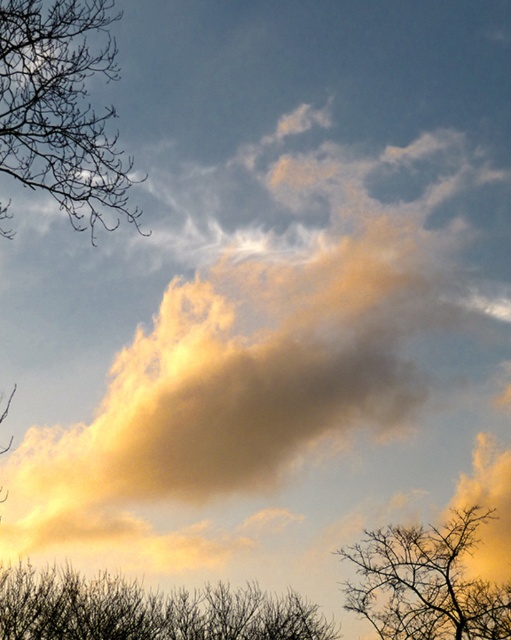
Can you confirm if silhouette bare branches at bottom is positioned to the left of brown textured tree at lower right?

Indeed, silhouette bare branches at bottom is positioned on the left side of brown textured tree at lower right.

Does silhouette bare branches at bottom have a lesser width compared to brown textured tree at lower right?

No, silhouette bare branches at bottom is not thinner than brown textured tree at lower right.

This screenshot has height=640, width=511. I want to click on silhouette bare branches at bottom, so [146, 609].

Is point (25, 44) farther from viewer compared to point (299, 609)?

No, it is in front of (299, 609).

Is bare branches at left positioned at the back of silhouette bare branches at bottom?

No, bare branches at left is closer to the viewer.

Which is behind, point (99, 141) or point (291, 598)?

Positioned behind is point (291, 598).

Image resolution: width=511 pixels, height=640 pixels. I want to click on bare branches at left, so click(61, 108).

Does bare branches at left lie in front of brown textured tree at lower right?

Yes, bare branches at left is closer to the viewer.

Which is behind, point (60, 132) or point (479, 616)?

The point (479, 616) is behind.

Where is `bare branches at left`? bare branches at left is located at coordinates (61, 108).